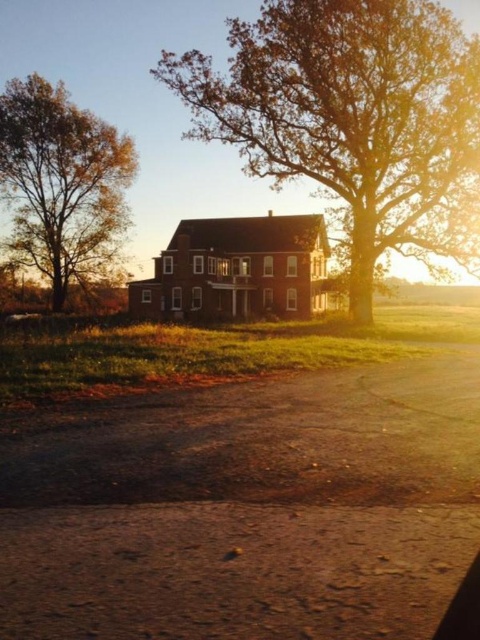
You are a farmer who wants to place a new fence between the brown textured tree at center and the brown brick barn at center. The fence requires a minimum of 50 feet of space between the two objects to be installed properly. Based on the scene, can you install the fence as planned?

The distance between the brown textured tree at center and the brown brick barn at center is 45.05 feet, which is less than the required 50 feet. Therefore, the fence cannot be installed as planned.

You are a farmer checking the weather. You notice the brown textured tree at center and the brown brick barn at center. Which one might block your view of the horizon during a storm?

The brown textured tree at center is bigger than the brown brick barn at center, so it would block your view of the horizon during a storm.